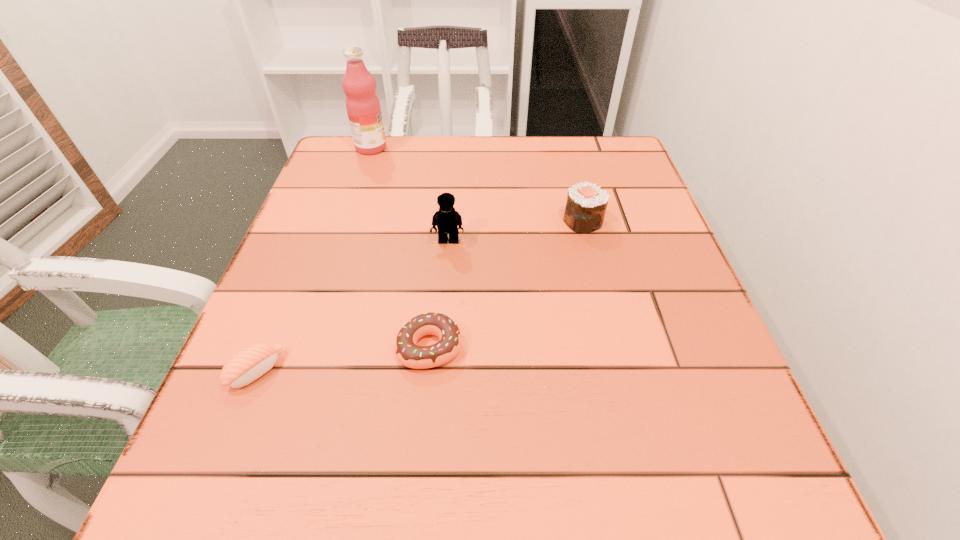
Image resolution: width=960 pixels, height=540 pixels. What are the coordinates of `free space located 0.400m on the front of the farther sushi` in the screenshot? It's located at (633, 416).

Locate an element on the screen. This screenshot has height=540, width=960. vacant region located 0.190m on the right of the left sushi is located at coordinates (402, 370).

Locate an element on the screen. This screenshot has width=960, height=540. free space located 0.150m on the front of the doughnut is located at coordinates (418, 473).

This screenshot has height=540, width=960. In order to click on object that is at the far edge in this screenshot , I will do `click(363, 107)`.

Identify the location of fruit juice at the left edge. (363, 107).

The width and height of the screenshot is (960, 540). In order to click on sushi at the left edge in this screenshot , I will do `click(249, 364)`.

The image size is (960, 540). What are the coordinates of `object that is at the right edge` in the screenshot? It's located at (586, 204).

I want to click on object located at the far left corner, so click(363, 107).

In order to click on vacant space at the far edge of the desktop in this screenshot , I will do `click(420, 159)`.

In order to click on vacant space at the near edge of the desktop in this screenshot , I will do `click(356, 524)`.